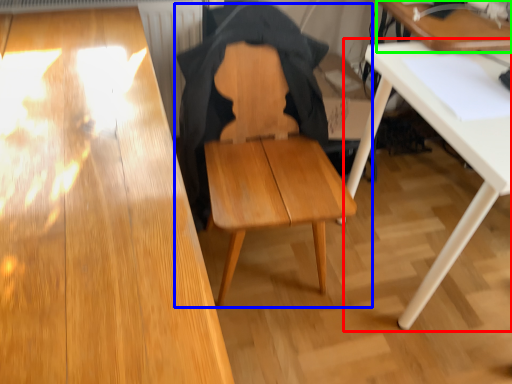
Question: Considering the real-world distances, which object is farthest from table (highlighted by a red box)? chair (highlighted by a blue box) or table (highlighted by a green box)?

Choices:
 (A) chair
 (B) table

Answer: (A)